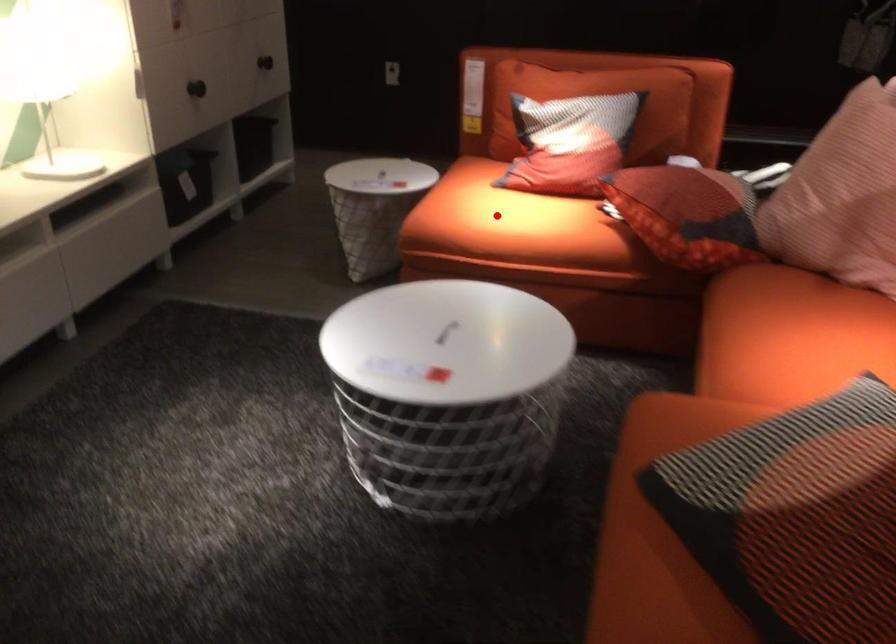
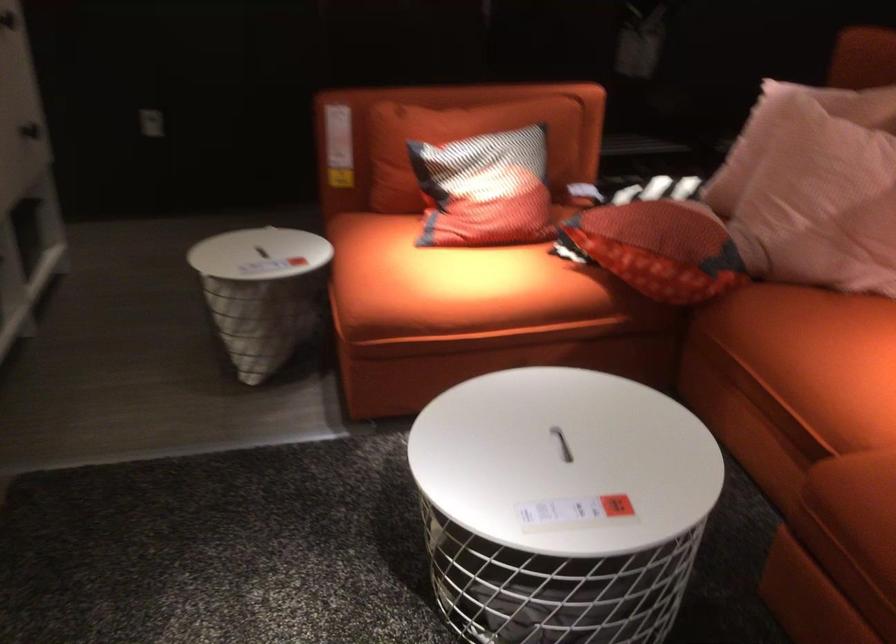
Find the pixel in the second image that matches the highlighted location in the first image.

(449, 281)